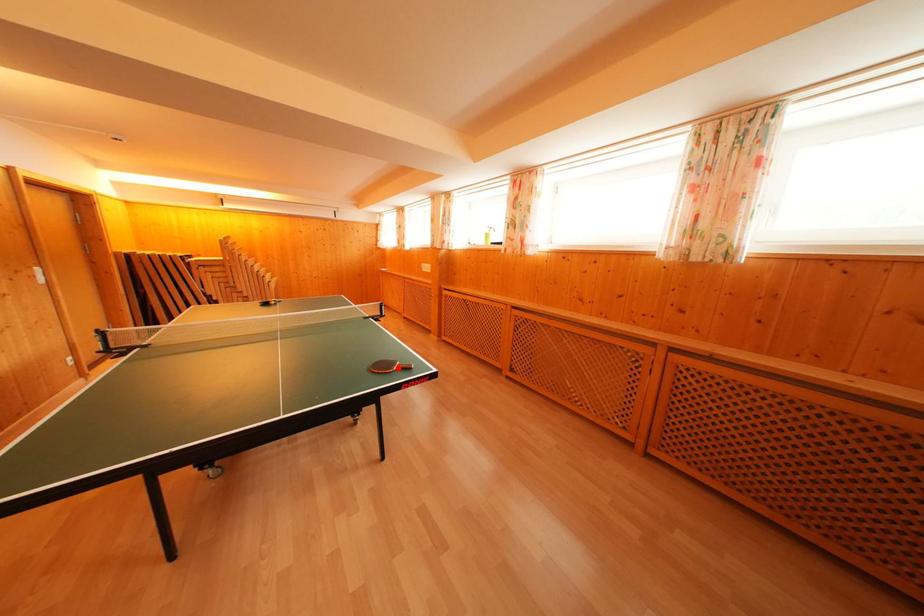
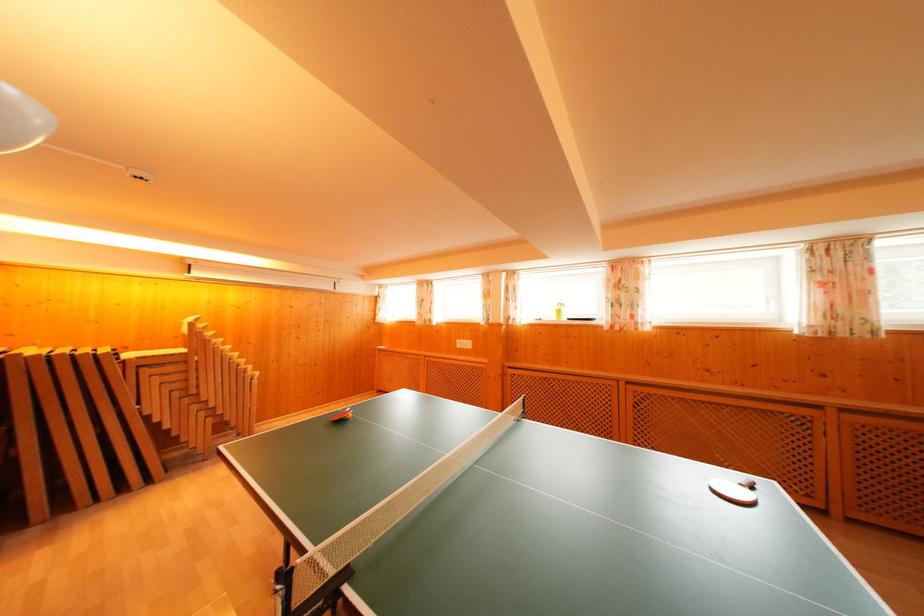
Question: I am providing you with two images of the same scene from different viewpoints. A red point is marked on the first image. Can you still see the location of the red point in image 2?

Choices:
 (A) Yes
 (B) No

Answer: (B)